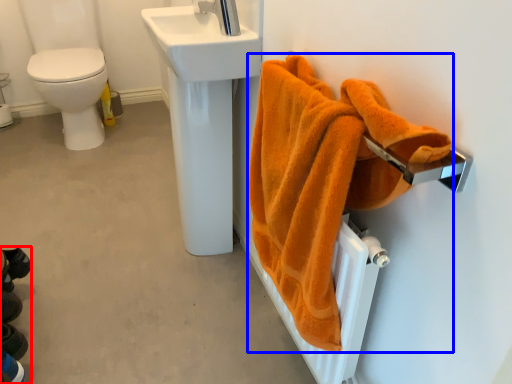
Question: Which point is closer to the camera, squat (highlighted by a red box) or towel (highlighted by a blue box)?

Choices:
 (A) squat
 (B) towel

Answer: (B)